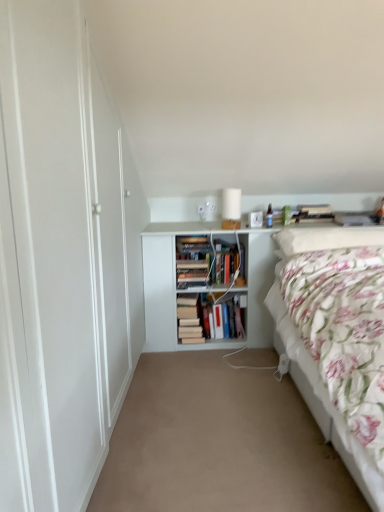
Locate an element on the screen. This screenshot has width=384, height=512. free spot above beige carpet at center (from a real-world perspective) is located at coordinates (210, 403).